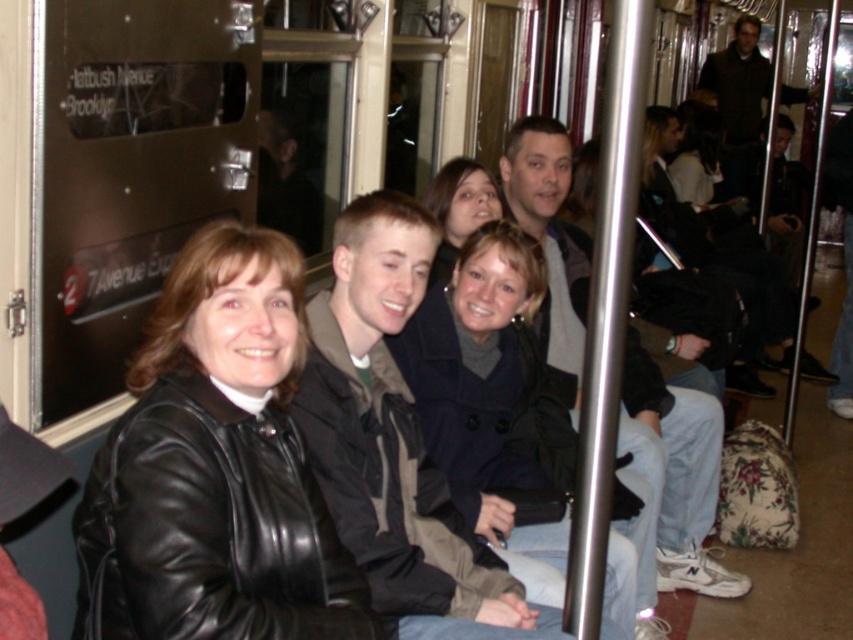
Question: Which point is farther to the camera?

Choices:
 (A) (746, 138)
 (B) (480, 348)
 (C) (665, 582)

Answer: (A)

Question: Considering the relative positions of light gray fabric jacket at center and dark brown sweater at upper right in the image provided, where is light gray fabric jacket at center located with respect to dark brown sweater at upper right?

Choices:
 (A) above
 (B) below

Answer: (B)

Question: Is dark blue coat at center above light gray fabric jacket at center?

Choices:
 (A) yes
 (B) no

Answer: (B)

Question: Considering the real-world distances, which object is closest to the black leather jacket at center?

Choices:
 (A) dark blue coat at center
 (B) matte black coat at center

Answer: (A)

Question: Which object is positioned farthest from the matte black coat at center?

Choices:
 (A) dark brown sweater at upper right
 (B) dark blue coat at center

Answer: (A)

Question: Does black leather jacket at center have a smaller size compared to matte black coat at center?

Choices:
 (A) yes
 (B) no

Answer: (B)